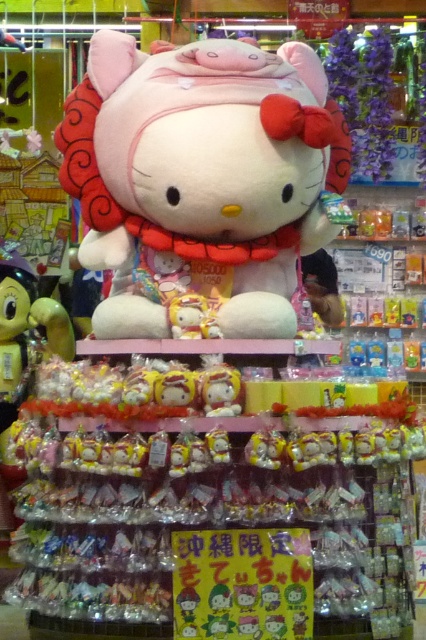
Question: Can you confirm if fluffy pink plush at center is positioned to the right of matte yellow plush toy at center?

Choices:
 (A) no
 (B) yes

Answer: (A)

Question: Which point is closer to the camera?

Choices:
 (A) fluffy pink plush at center
 (B) matte yellow plush toy at center

Answer: (A)

Question: Can you confirm if fluffy pink plush at center is positioned below matte yellow plush toy at center?

Choices:
 (A) no
 (B) yes

Answer: (A)

Question: Which point is farther to the camera?

Choices:
 (A) fluffy pink plush at center
 (B) matte yellow plush toy at center

Answer: (B)

Question: Can you confirm if fluffy pink plush at center is positioned above matte yellow plush toy at center?

Choices:
 (A) yes
 (B) no

Answer: (A)